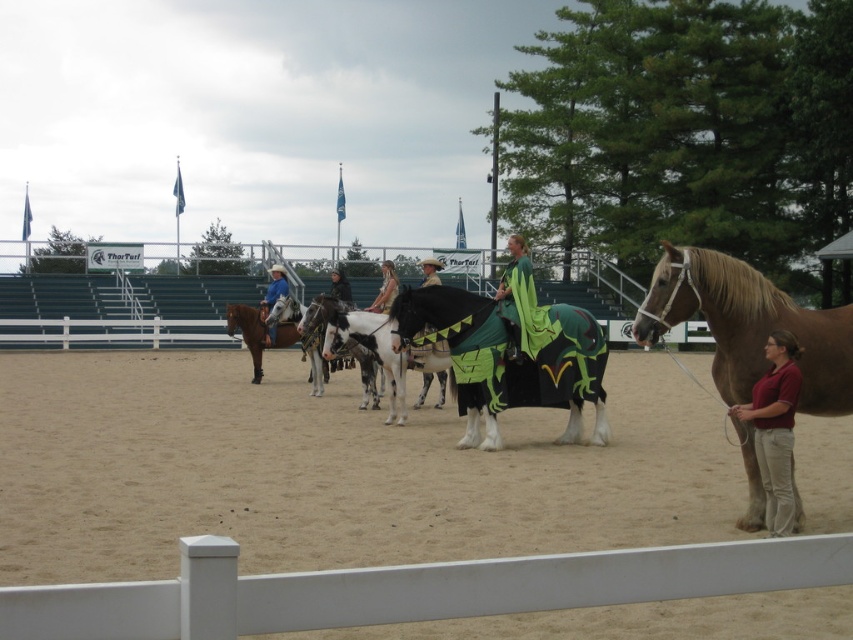
Question: Does sandy dirt field at center have a larger size compared to white speckled horse at center?

Choices:
 (A) no
 (B) yes

Answer: (B)

Question: Is golden brown horse at right in front of brown cotton pants at lower right?

Choices:
 (A) yes
 (B) no

Answer: (B)

Question: Which point appears farthest from the camera in this image?

Choices:
 (A) (44, 394)
 (B) (380, 301)
 (C) (653, 336)

Answer: (A)

Question: Is sandy dirt field at center bigger than golden brown horse at right?

Choices:
 (A) no
 (B) yes

Answer: (B)

Question: Which point is closer to the camera?

Choices:
 (A) sandy dirt field at center
 (B) black glossy horse at center

Answer: (A)

Question: Based on their relative distances, which object is nearer to the brown glossy horse at center?

Choices:
 (A) white glossy horse at center
 (B) blue denim shirt at center

Answer: (B)